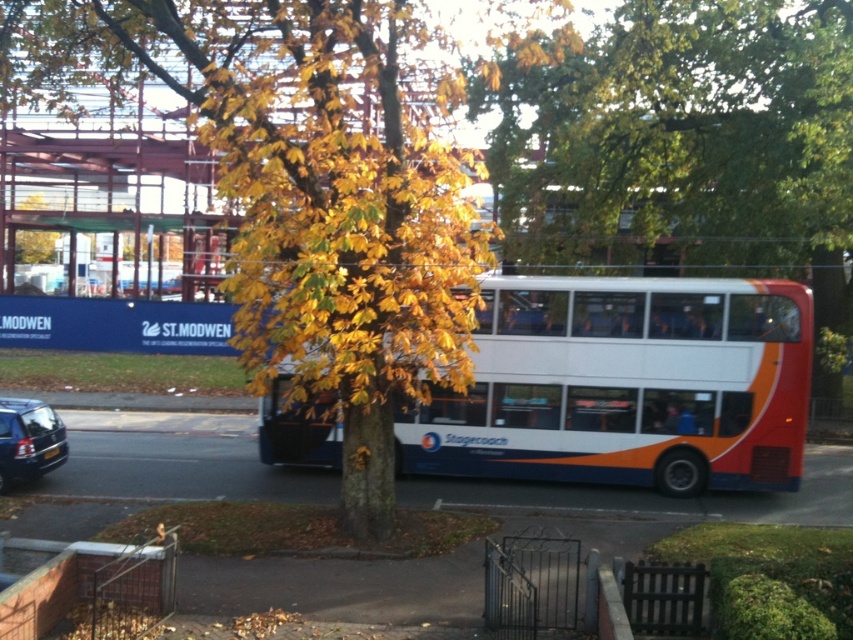
Question: Considering the real-world distances, which object is closest to the yellow-green leaves at center?

Choices:
 (A) white/orange/blue stagecoach bus at center
 (B) matte black car at lower left

Answer: (B)

Question: Estimate the real-world distances between objects in this image. Which object is closer to the white/orange/blue stagecoach bus at center?

Choices:
 (A) matte black car at lower left
 (B) yellow-green leaves at center

Answer: (A)

Question: Can you confirm if yellow-green leaves at center is bigger than white/orange/blue stagecoach bus at center?

Choices:
 (A) yes
 (B) no

Answer: (A)

Question: Is yellow-green leaves at center above matte black car at lower left?

Choices:
 (A) no
 (B) yes

Answer: (B)

Question: Which point appears closest to the camera in this image?

Choices:
 (A) (343, 291)
 (B) (28, 426)

Answer: (A)

Question: Does yellow-green leaves at center have a lesser width compared to white/orange/blue stagecoach bus at center?

Choices:
 (A) no
 (B) yes

Answer: (A)